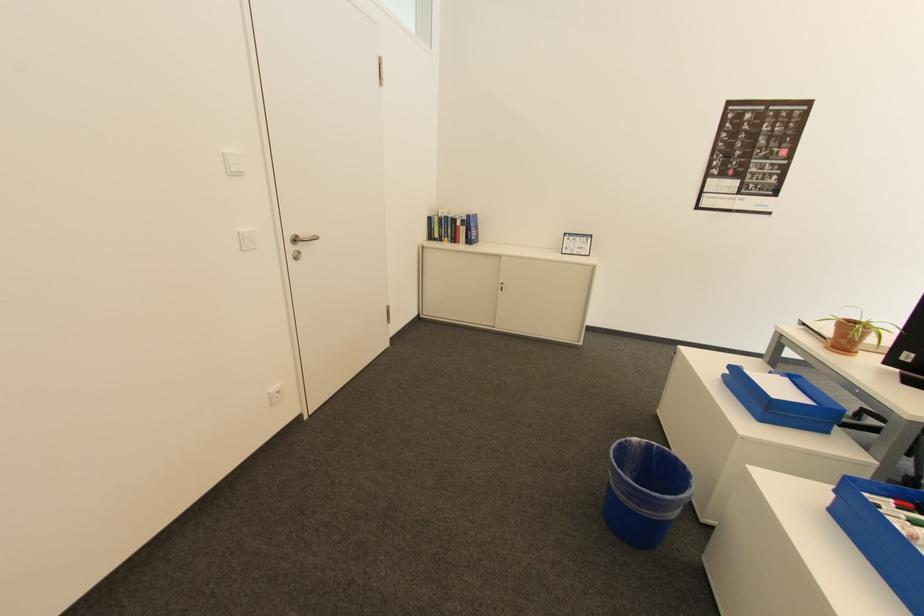
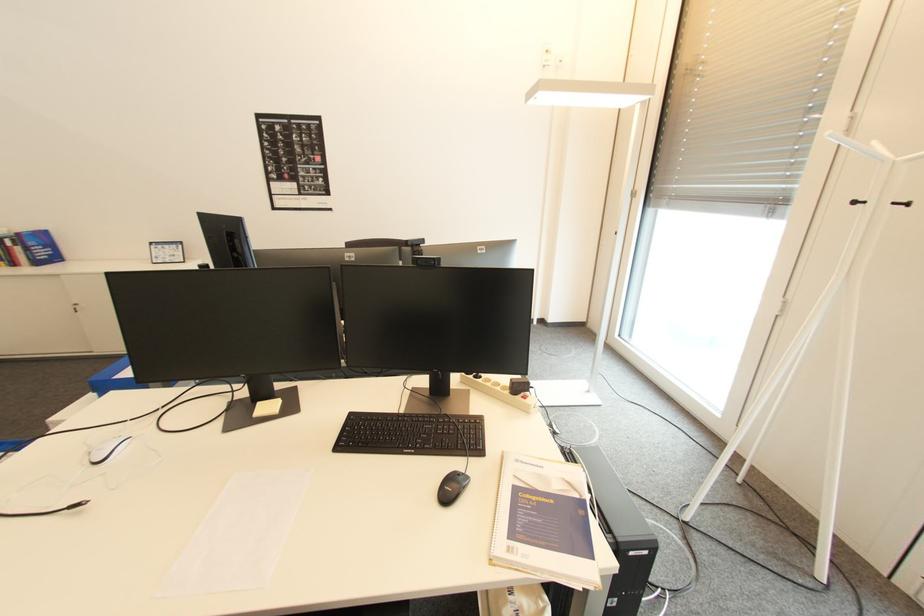
Question: Which direction would the cameraman need to move to produce the second image? Reply with the corresponding letter.

Choices:
 (A) Left
 (B) Right
 (C) Forward
 (D) Backward

Answer: (B)